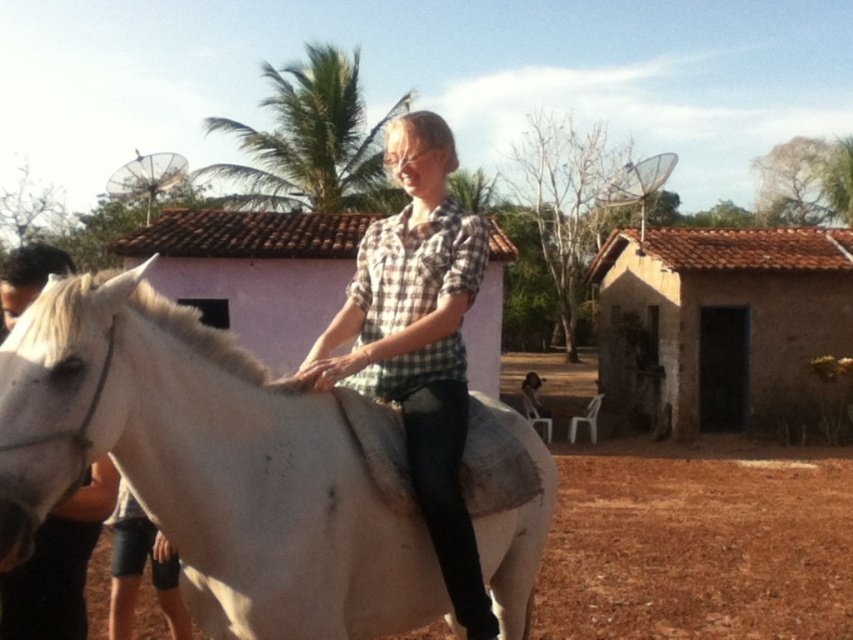
You are a photographer planning to take a photo of both the white matte horse at center and the white matte horse at left. You want to ensure both horses are fully visible in the frame. Given their heights, which horse should you focus on positioning first to avoid cropping either of them?

The white matte horse at center is taller than the white matte horse at left. Therefore, you should focus on positioning the white matte horse at center first to ensure it fits within the frame without being cropped, as its greater height may require more space.

You are standing at the point marked as point (718, 324) in the image. What structure is directly in front of you?

The point (718, 324) corresponds to the brown mud hut at center, so the structure directly in front of you is the brown mud hut at center.